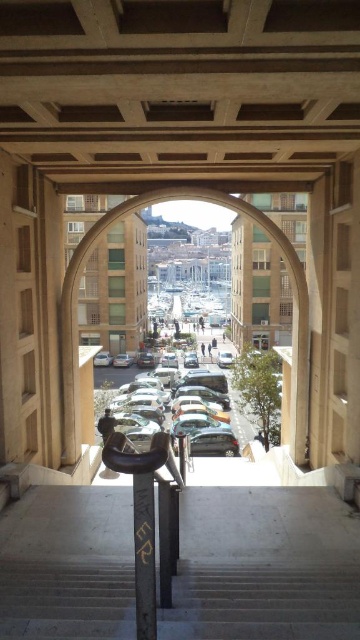
In the scene shown: You are standing at the entrance of the architectural structure and want to take a photo of the shiny silver car at center. However, you notice the gray concrete stairs at center might block your view. Based on the scene description, will the stairs block the car from your view?

The gray concrete stairs at center is in front of the shiny silver car at center, so the stairs will block the view of the car.

You are a delivery person trying to navigate through the gray concrete stairs at center and the shiny silver car at center. Which object is shorter and therefore easier to step over?

The gray concrete stairs at center is shorter than the shiny silver car at center, so it would be easier to step over.